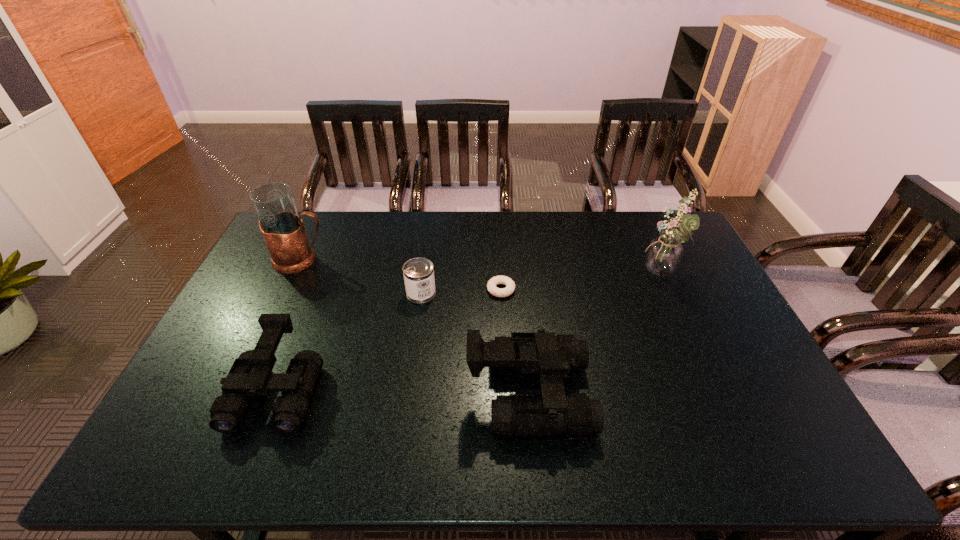
In the current image, all binocularss are evenly spaced. To maintain this equal spacing, where should an additional binoculars be placed on the right? Please point out a free spot. Please provide its 2D coordinates. Your answer should be formatted as a tuple, i.e. [(x, y)], where the tuple contains the x and y coordinates of a point satisfying the conditions above.

[(783, 398)]